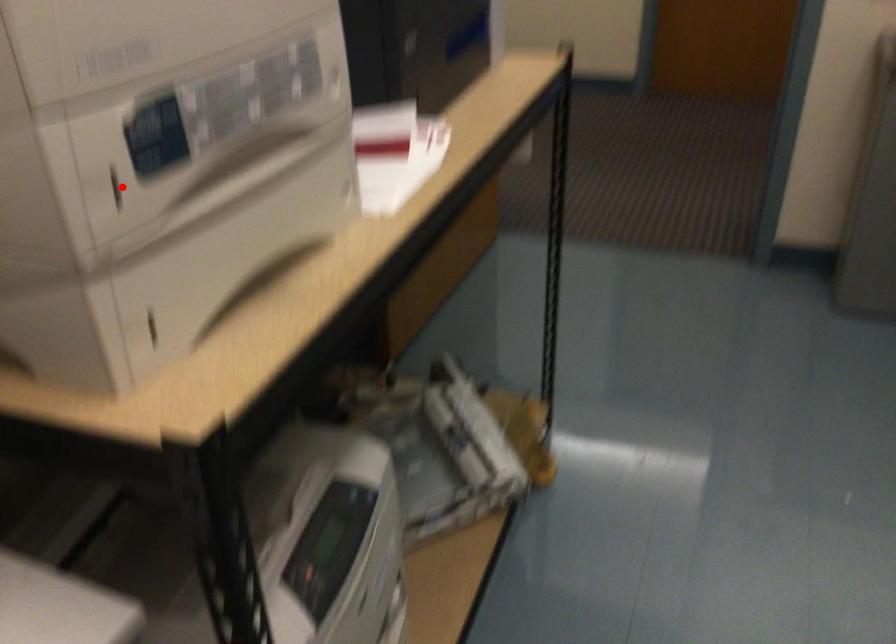
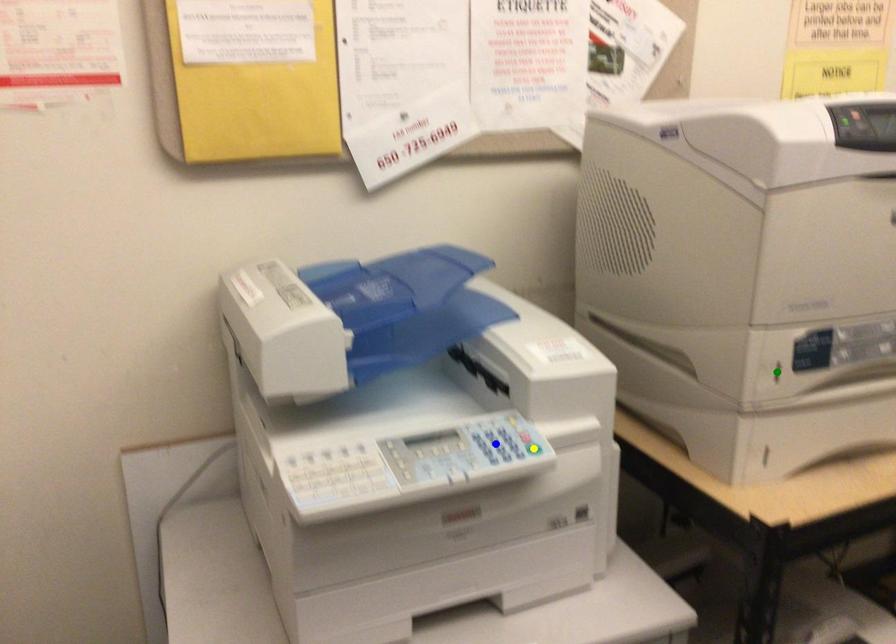
Question: I am providing you with two images of the same scene from different viewpoints. A red point is marked on the first image. You are given multiple points on the second image. Which point in image 2 represents the same 3d spot as the red point in image 1?

Choices:
 (A) blue point
 (B) green point
 (C) yellow point

Answer: (B)